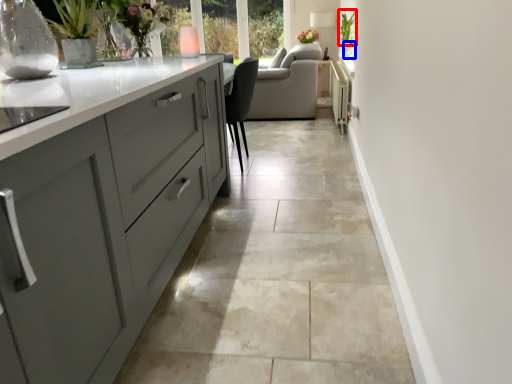
Question: Which point is closer to the camera, plant (highlighted by a red box) or glass vase (highlighted by a blue box)?

Choices:
 (A) plant
 (B) glass vase

Answer: (B)